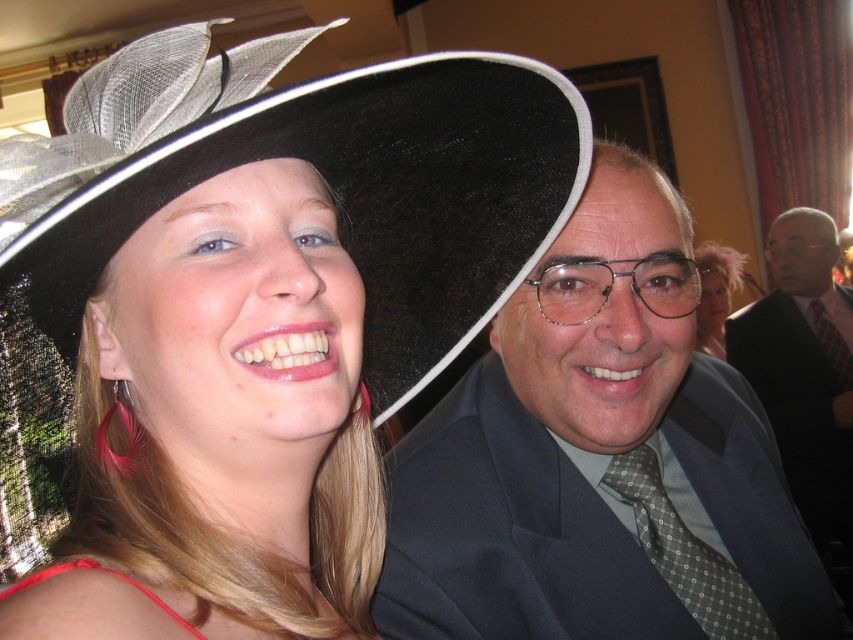
Question: Is matte black hat at center to the left of red satin dress at lower left from the viewer's perspective?

Choices:
 (A) yes
 (B) no

Answer: (B)

Question: Which of the following is the farthest from the observer?

Choices:
 (A) (688, 554)
 (B) (830, 348)
 (C) (810, 298)
 (D) (703, 602)

Answer: (C)

Question: Which object is the farthest from the shiny silver hat at upper left?

Choices:
 (A) matte black hat at center
 (B) matte pink feather at upper right
 (C) black felt hat at upper left
 (D) green textured tie at right

Answer: (B)

Question: In this image, where is shiny silver hat at upper left located relative to red satin dress at lower left?

Choices:
 (A) below
 (B) above

Answer: (B)

Question: Does black felt hat at upper left have a lesser width compared to green textured tie at right?

Choices:
 (A) yes
 (B) no

Answer: (B)

Question: Among these objects, which one is farthest from the camera?

Choices:
 (A) green textured tie at right
 (B) black felt hat at upper left
 (C) matte pink feather at upper right

Answer: (C)